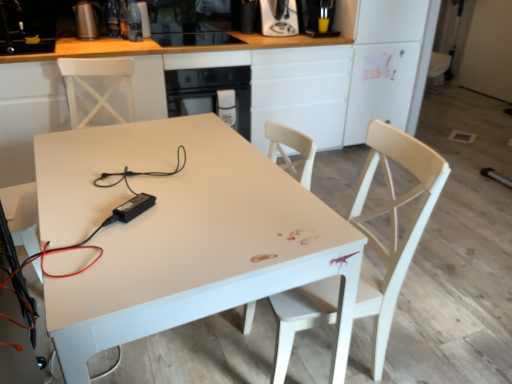
Find the location of a particular element. Image resolution: width=512 pixels, height=384 pixels. free spot to the left of black plastic power adapter at center, the 3th appliance from the left is located at coordinates (84, 216).